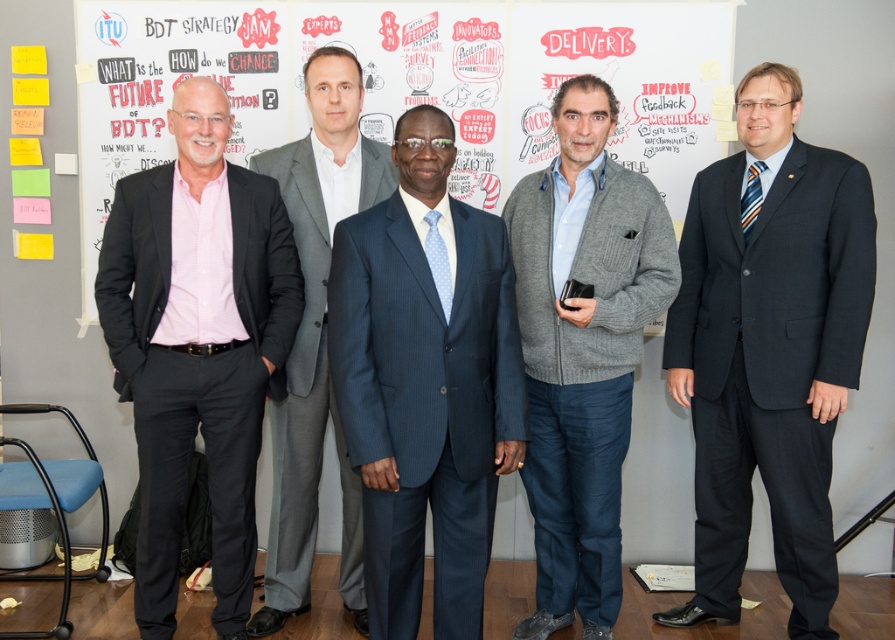
Does blue pinstripe suit at center lie behind gray knitted cardigan at center?

No, blue pinstripe suit at center is closer to the viewer.

Looking at this image, can you confirm if blue pinstripe suit at center is wider than gray knitted cardigan at center?

Yes.

Between point (416, 369) and point (604, 125), which one is positioned in front?

Positioned in front is point (416, 369).

I want to click on blue pinstripe suit at center, so click(425, 381).

Is dark gray suit at right closer to camera compared to blue pinstripe suit at center?

No, it is not.

Is dark gray suit at right taller than blue pinstripe suit at center?

Correct, dark gray suit at right is much taller as blue pinstripe suit at center.

Locate an element on the screen. This screenshot has height=640, width=895. dark gray suit at right is located at coordinates (769, 348).

Who is positioned more to the left, matte black suit at left or gray suit at center?

matte black suit at left is more to the left.

Is matte black suit at left to the left of gray suit at center from the viewer's perspective?

Correct, you'll find matte black suit at left to the left of gray suit at center.

Does point (209, 301) come farther from viewer compared to point (307, 444)?

That is False.

The width and height of the screenshot is (895, 640). Identify the location of matte black suit at left. (197, 346).